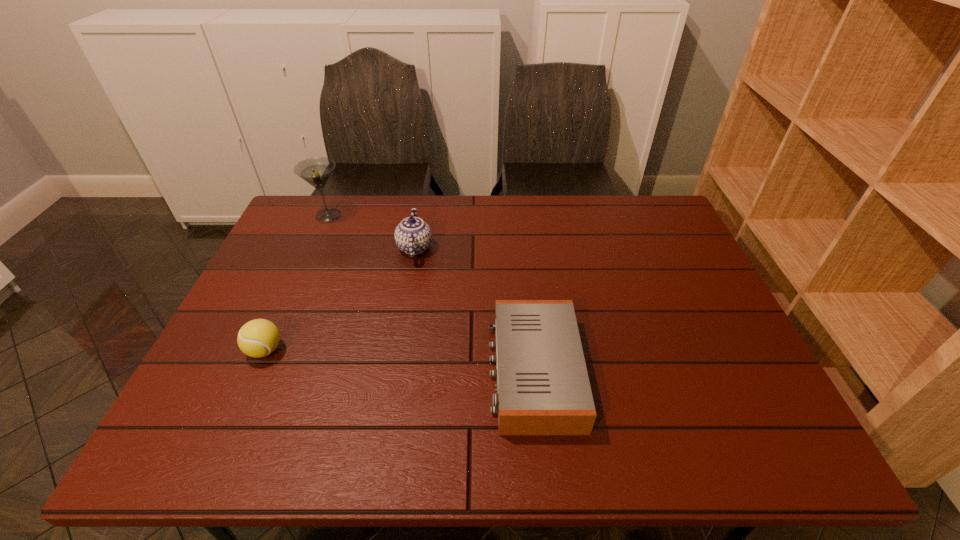
You are a GUI agent. You are given a task and a screenshot of the screen. Output one action in this format:
    pyautogui.click(x=<x>, y=<y>)
    Task: Click on the vacant point located on the front panel of the radio receiver
    Image resolution: width=960 pixels, height=540 pixels.
    Given the screenshot: What is the action you would take?
    pyautogui.click(x=424, y=372)

I want to click on vacant region located on the front panel of the radio receiver, so click(403, 372).

You are a GUI agent. You are given a task and a screenshot of the screen. Output one action in this format:
    pyautogui.click(x=<x>, y=<y>)
    Task: Click on the free space located 0.220m on the front panel of the radio receiver
    
    Given the screenshot: What is the action you would take?
    pyautogui.click(x=394, y=372)

Locate an element on the screen. martini that is positioned at the far edge is located at coordinates (316, 171).

Where is `chinaware present at the far edge`? chinaware present at the far edge is located at coordinates (413, 236).

This screenshot has width=960, height=540. In order to click on object at the near edge in this screenshot , I will do `click(543, 388)`.

Find the location of a particular element. martini located at the left edge is located at coordinates (316, 171).

This screenshot has width=960, height=540. In order to click on tennis ball that is at the left edge in this screenshot , I will do `click(257, 338)`.

Locate an element on the screen. This screenshot has height=540, width=960. object at the far left corner is located at coordinates (316, 171).

This screenshot has height=540, width=960. In the image, there is a desktop. In order to click on vacant area at the far edge in this screenshot , I will do `click(572, 214)`.